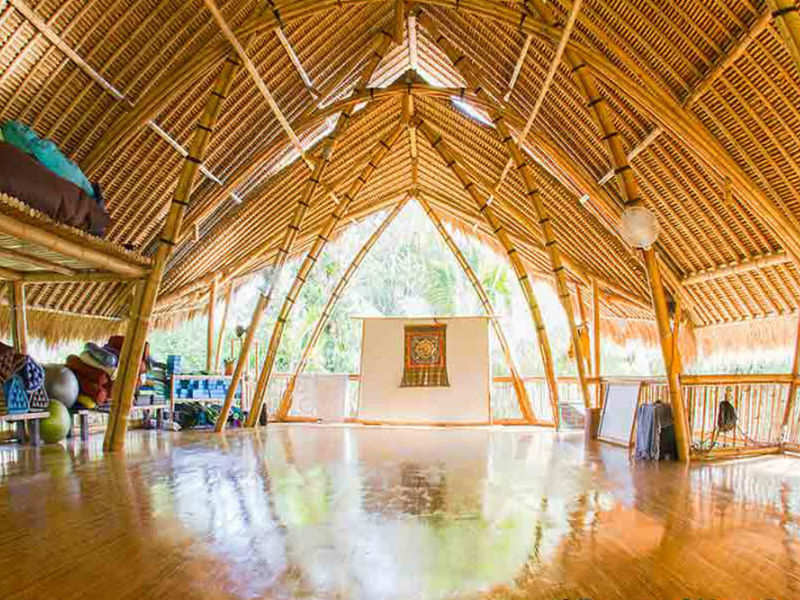
The image size is (800, 600). What are the coordinates of `wood floors` in the screenshot? It's located at (644, 581), (222, 520).